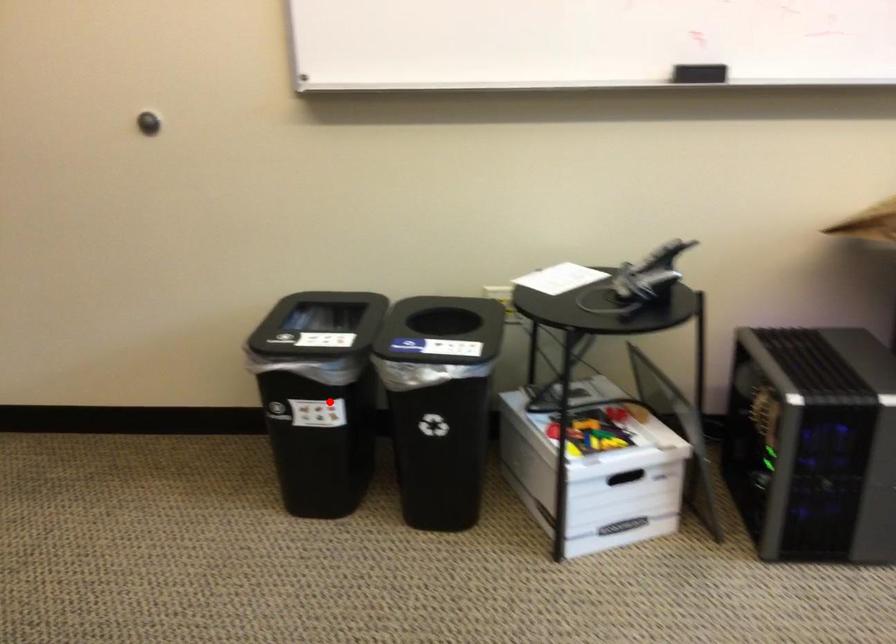
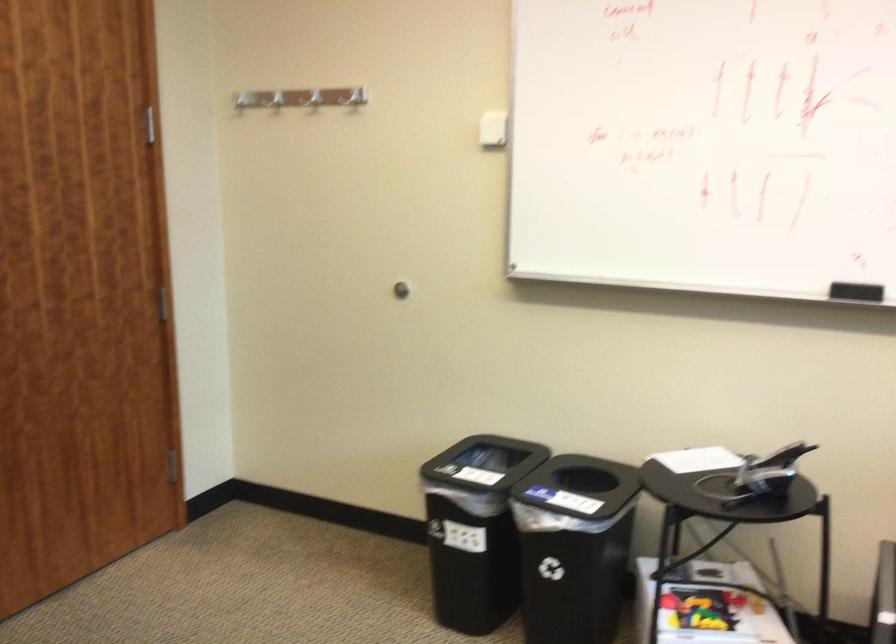
Question: A red point is marked in image1. In image2, is the corresponding 3D point closer to the camera or farther? Reply with the corresponding letter.

Choices:
 (A) The corresponding 3D point is closer.
 (B) The corresponding 3D point is farther.

Answer: (B)